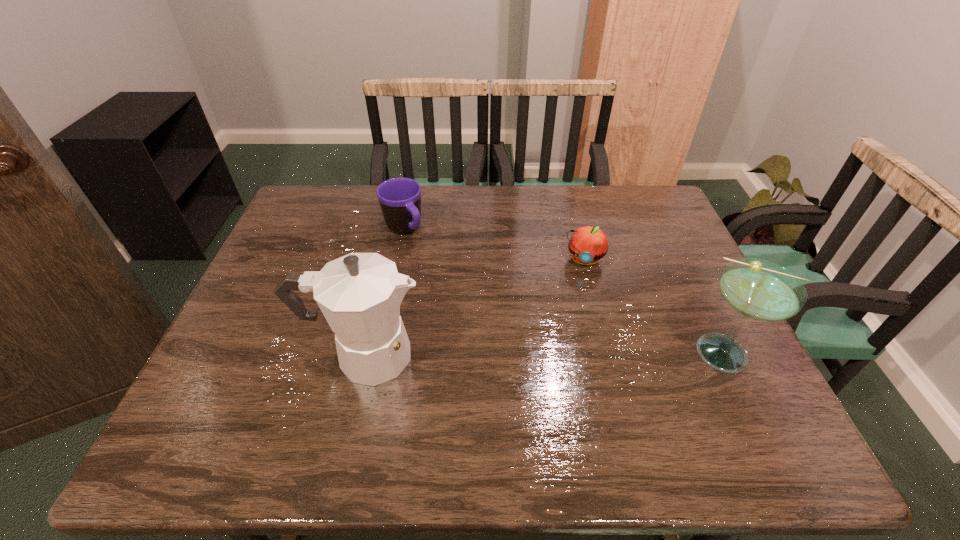
Locate an element on the screen. Image resolution: width=960 pixels, height=540 pixels. unoccupied position between the tallest object and the third object from left to right is located at coordinates (474, 307).

Locate an element on the screen. Image resolution: width=960 pixels, height=540 pixels. blank region between the third shortest object and the coffeepot is located at coordinates (546, 354).

The height and width of the screenshot is (540, 960). I want to click on empty location between the coffeepot and the second object from right to left, so click(x=474, y=307).

Where is `object that stands as the second closest to the tallest object`? object that stands as the second closest to the tallest object is located at coordinates tap(588, 244).

Select which object appears as the second closest to the mug. Please provide its 2D coordinates. Your answer should be formatted as a tuple, i.e. [(x, y)], where the tuple contains the x and y coordinates of a point satisfying the conditions above.

[(588, 244)]

Where is `free space that satisfies the following two spatial constraints: 1. on the front side of the second tallest object; 2. on the right side of the apple`? The height and width of the screenshot is (540, 960). free space that satisfies the following two spatial constraints: 1. on the front side of the second tallest object; 2. on the right side of the apple is located at coordinates (607, 353).